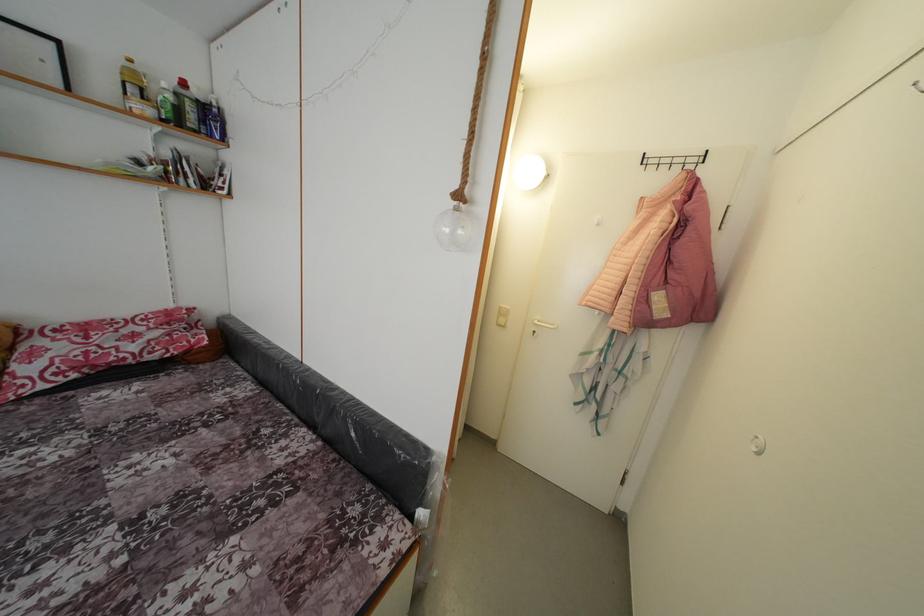
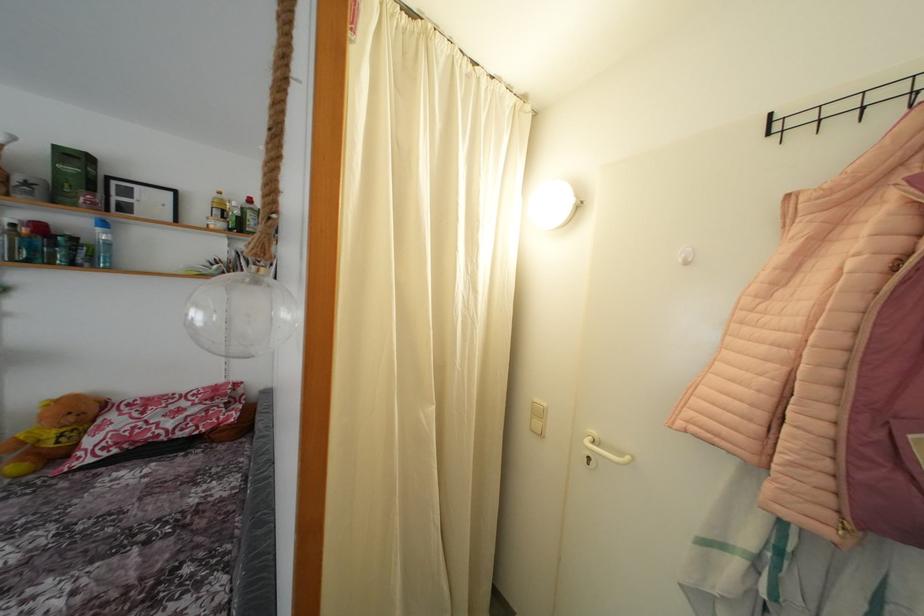
In the second image, find the point that corresponds to pixel 506 312 in the first image.

(541, 406)